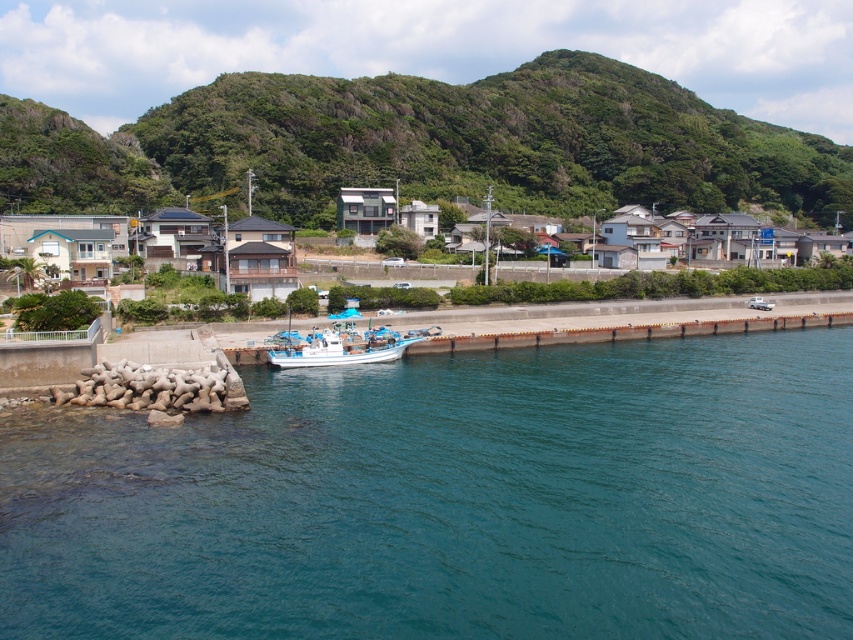
Question: Among these objects, which one is farthest from the camera?

Choices:
 (A) green leafy hillside at upper center
 (B) concrete dock at center
 (C) white plastic boat at center

Answer: (A)

Question: Which point is farther to the camera?

Choices:
 (A) concrete dock at center
 (B) teal water at lower center
 (C) white plastic boat at center

Answer: (A)

Question: Is teal water at lower center further to the viewer compared to white plastic boat at center?

Choices:
 (A) yes
 (B) no

Answer: (B)

Question: Which point is farther to the camera?

Choices:
 (A) concrete dock at center
 (B) white plastic boat at center
 (C) teal water at lower center

Answer: (A)

Question: Where is concrete dock at center located in relation to white plastic boat at center in the image?

Choices:
 (A) above
 (B) below

Answer: (A)

Question: From the image, what is the correct spatial relationship of teal water at lower center in relation to white plastic boat at center?

Choices:
 (A) right
 (B) left

Answer: (A)